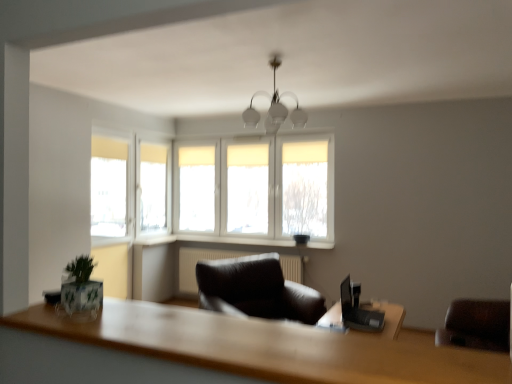
Question: Is point (81, 304) positioned closer to the camera than point (325, 241)?

Choices:
 (A) closer
 (B) farther

Answer: (A)

Question: Which is correct: green matte plant at lower left is inside white plastic window sill at center, the first window sill when ordered from right to left, or outside of it?

Choices:
 (A) outside
 (B) inside

Answer: (A)

Question: Considering the real-world distances, which object is farthest from the black plastic laptop at right?

Choices:
 (A) white plastic window sill at center, which is the second window sill from right to left
 (B) white plastic window sill at center, the first window sill when ordered from right to left
 (C) white frosted glass chandelier at center
 (D) white fabric window at center
 (E) green matte plant at lower left

Answer: (A)

Question: Considering the real-world distances, which object is farthest from the black plastic laptop at right?

Choices:
 (A) green matte plant at lower left
 (B) white plastic window sill at center, the first window sill when ordered from right to left
 (C) white fabric window at center
 (D) wooden table at lower center
 (E) white plastic window sill at center, which is the second window sill from right to left

Answer: (E)